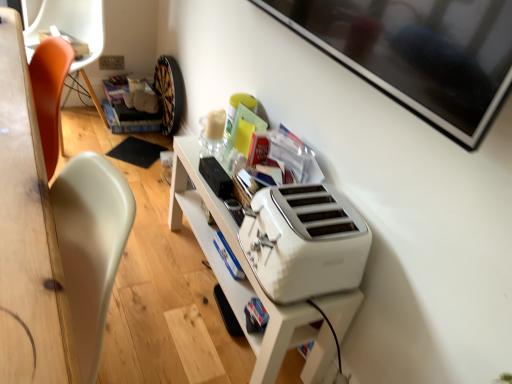
At what (x,y) coordinates should I click in order to perform the action: click on orange plastic chair at left. Please return your answer as a coordinate pair (x, y). The image size is (512, 384). Looking at the image, I should click on (73, 33).

What do you see at coordinates (73, 33) in the screenshot? I see `orange plastic chair at left` at bounding box center [73, 33].

Image resolution: width=512 pixels, height=384 pixels. What do you see at coordinates (304, 242) in the screenshot?
I see `white plastic toaster at lower center` at bounding box center [304, 242].

Where is `white plastic toaster at lower center`? white plastic toaster at lower center is located at coordinates click(304, 242).

What are the coordinates of `orange plastic chair at left` in the screenshot? It's located at (73, 33).

Considering the positions of objects orange plastic chair at left and white plastic toaster at lower center in the image provided, who is more to the left, orange plastic chair at left or white plastic toaster at lower center?

From the viewer's perspective, orange plastic chair at left appears more on the left side.

Which object is closer to the camera taking this photo, orange plastic chair at left or white plastic toaster at lower center?

white plastic toaster at lower center is in front.

Which is farther from the camera, (40, 16) or (282, 271)?

The point (40, 16) is farther.

Based on the photo, from the image's perspective, is orange plastic chair at left above white plastic toaster at lower center?

Yes, from the image's perspective, orange plastic chair at left is over white plastic toaster at lower center.

From a real-world perspective, is orange plastic chair at left positioned above or below white plastic toaster at lower center?

In terms of real-world spatial position, orange plastic chair at left is below white plastic toaster at lower center.

Considering the sizes of objects orange plastic chair at left and white plastic toaster at lower center in the image provided, who is wider, orange plastic chair at left or white plastic toaster at lower center?

orange plastic chair at left is wider.

Who is taller, orange plastic chair at left or white plastic toaster at lower center?

orange plastic chair at left.

Can you confirm if orange plastic chair at left is bigger than white plastic toaster at lower center?

Yes.

Based on the photo, is orange plastic chair at left completely or partially outside of white plastic toaster at lower center?

Yes, orange plastic chair at left is outside of white plastic toaster at lower center.

Are orange plastic chair at left and white plastic toaster at lower center beside each other?

There is a gap between orange plastic chair at left and white plastic toaster at lower center.

Looking at this image, is white plastic toaster at lower center at the back of orange plastic chair at left?

No.

How many degrees apart are the facing directions of orange plastic chair at left and white plastic toaster at lower center?

The facing directions of orange plastic chair at left and white plastic toaster at lower center are 47 degrees apart.

Identify the location of chair below the white plastic toaster at lower center (from a real-world perspective). (73, 33).

Visually, is white plastic toaster at lower center positioned to the left or to the right of orange plastic chair at left?

Based on their positions, white plastic toaster at lower center is located to the right of orange plastic chair at left.

In the image, is white plastic toaster at lower center positioned in front of or behind orange plastic chair at left?

white plastic toaster at lower center is positioned closer to the viewer than orange plastic chair at left.

Considering the positions of point (305, 209) and point (89, 17), is point (305, 209) closer or farther from the camera than point (89, 17)?

Point (305, 209).

From the image's perspective, is white plastic toaster at lower center located beneath orange plastic chair at left?

Yes.

From a real-world perspective, is white plastic toaster at lower center above or below orange plastic chair at left?

From a real-world perspective, white plastic toaster at lower center is physically above orange plastic chair at left.

Considering the sizes of objects white plastic toaster at lower center and orange plastic chair at left in the image provided, who is wider, white plastic toaster at lower center or orange plastic chair at left?

With larger width is orange plastic chair at left.

Can you confirm if white plastic toaster at lower center is shorter than orange plastic chair at left?

Correct, white plastic toaster at lower center is not as tall as orange plastic chair at left.

Is white plastic toaster at lower center bigger or smaller than orange plastic chair at left?

In the image, white plastic toaster at lower center appears to be smaller than orange plastic chair at left.

In the scene shown: Does white plastic toaster at lower center contain orange plastic chair at left?

Actually, orange plastic chair at left is outside white plastic toaster at lower center.

Consider the image. Is white plastic toaster at lower center directly adjacent to orange plastic chair at left?

white plastic toaster at lower center and orange plastic chair at left are not in contact.

Is orange plastic chair at left at the back of white plastic toaster at lower center?

That's not correct — white plastic toaster at lower center is not looking away from orange plastic chair at left.

How distant is white plastic toaster at lower center from orange plastic chair at left?

white plastic toaster at lower center and orange plastic chair at left are 1.49 meters apart from each other.

The width and height of the screenshot is (512, 384). In the image, there is a white plastic toaster at lower center. Find the location of `chair below it (from a real-world perspective)`. chair below it (from a real-world perspective) is located at coordinates (73, 33).

At what (x,y) coordinates should I click in order to perform the action: click on chair that appears above the white plastic toaster at lower center (from the image's perspective). Please return your answer as a coordinate pair (x, y). Looking at the image, I should click on click(x=73, y=33).

I want to click on chair below the white plastic toaster at lower center (from a real-world perspective), so click(73, 33).